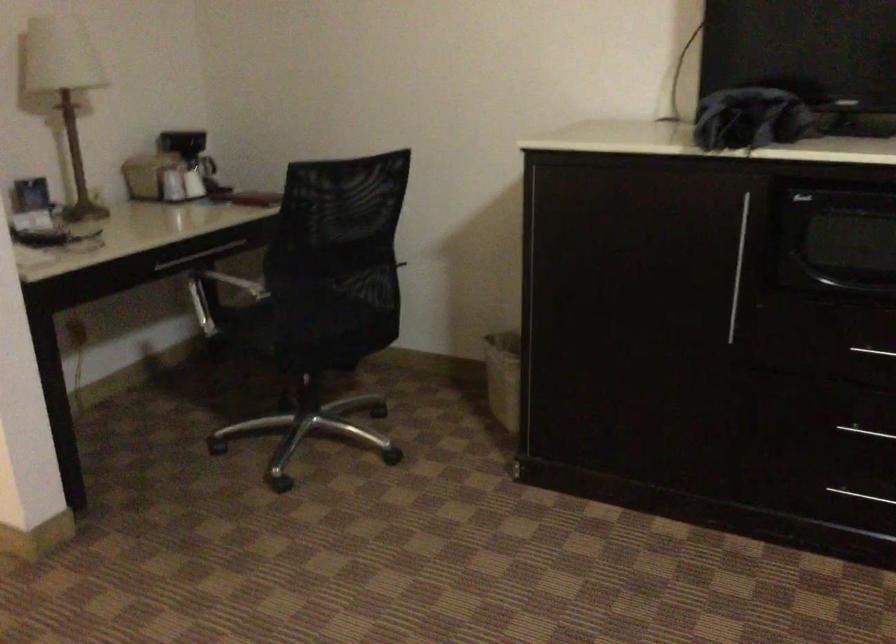
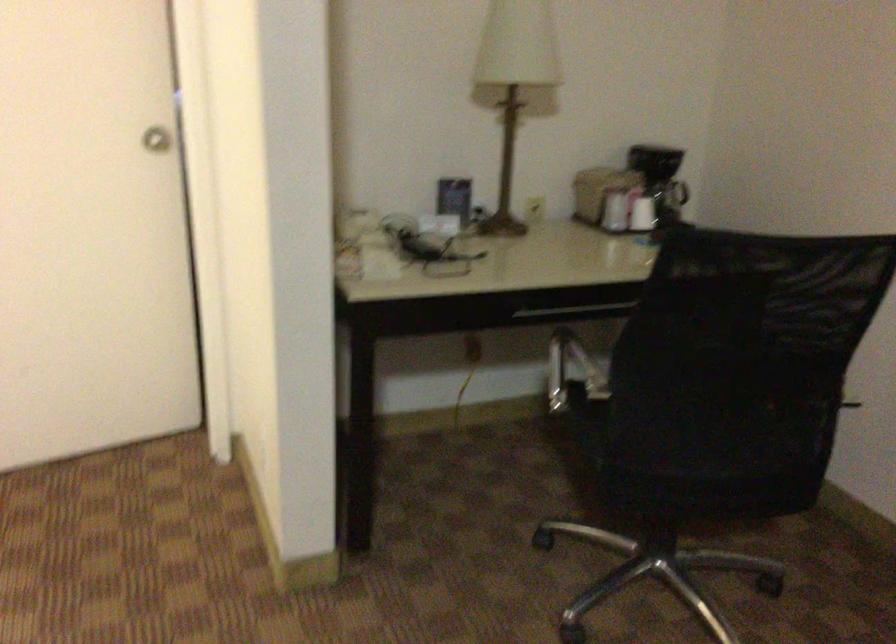
Find the pixel in the second image that matches point 151,169 in the first image.

(598, 192)